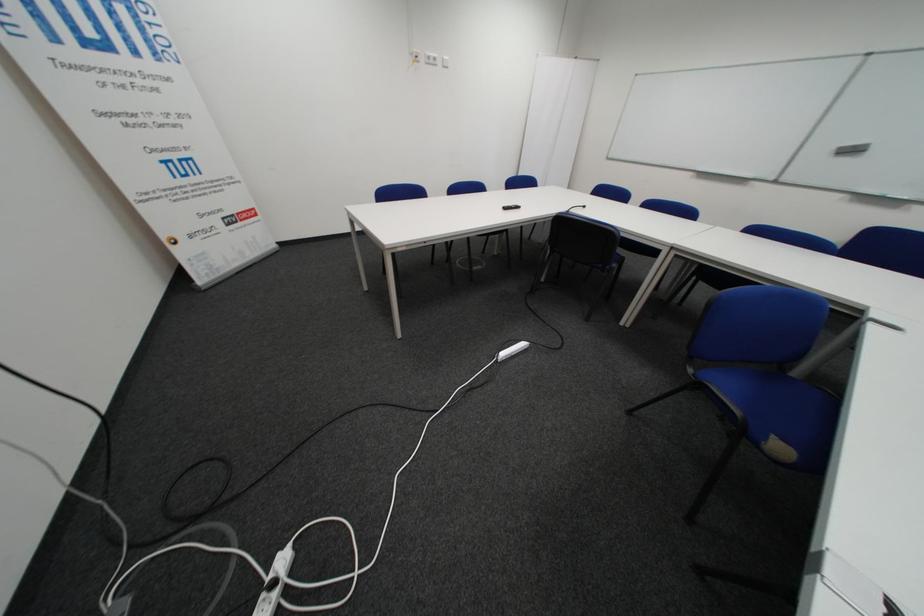
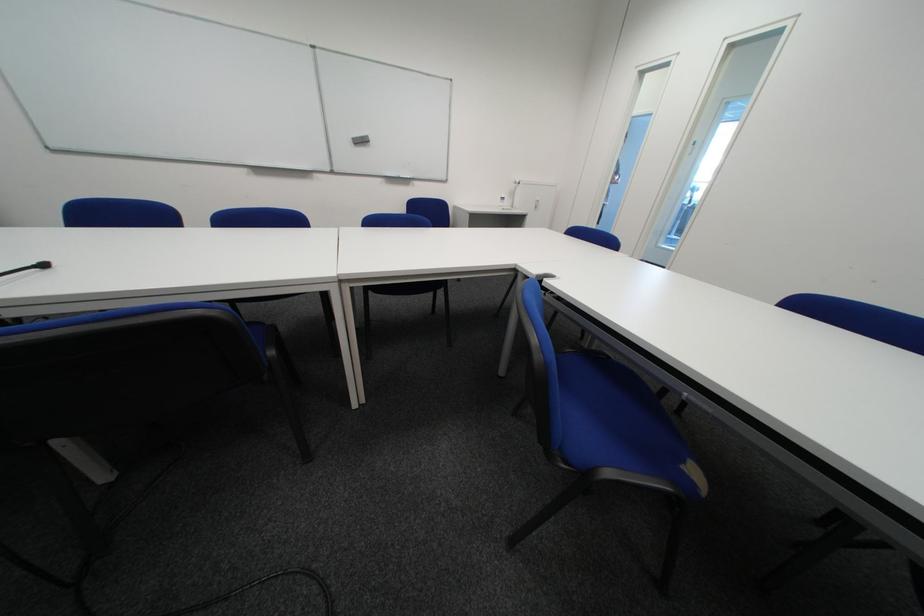
In the second image, find the point that corresponds to the point at 706,376 in the first image.

(578, 464)